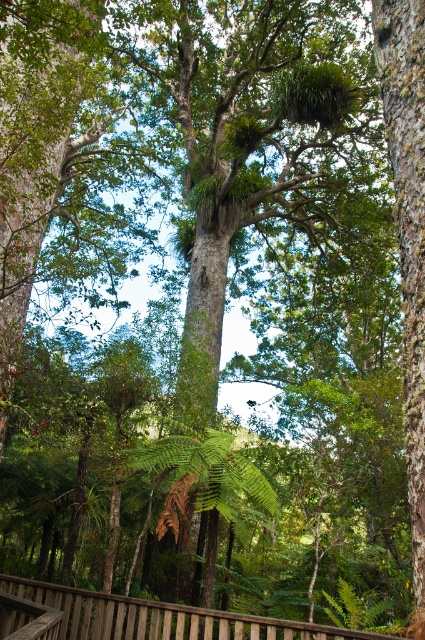
You are a hiker standing in the forest and want to take a photo of the rough bark tree at right. You see a point marked at coordinates [408,230]. Where should you aim your camera to capture the rough bark tree at right?

The rough bark tree at right is located at point [408,230], so you should aim your camera at that coordinate to capture it.

You are a hiker who wants to take a photo of the green leafy fern at center. To avoid blocking the fern with the rough bark tree at right in your photo, which direction should you move to?

You should move to the left side to avoid blocking the green leafy fern at center with the rough bark tree at right, since the rough bark tree at right is positioned on the right side of the green leafy fern at center.

Consider the image. You are a hiker who wants to sit on the brown wooden rail at lower center. However, you notice a green leafy fern at center nearby. Considering their sizes, which object would you choose to sit on and why?

The brown wooden rail at lower center is larger in size than the green leafy fern at center, so you should sit on the brown wooden rail at lower center because it can support your weight better due to its larger size.